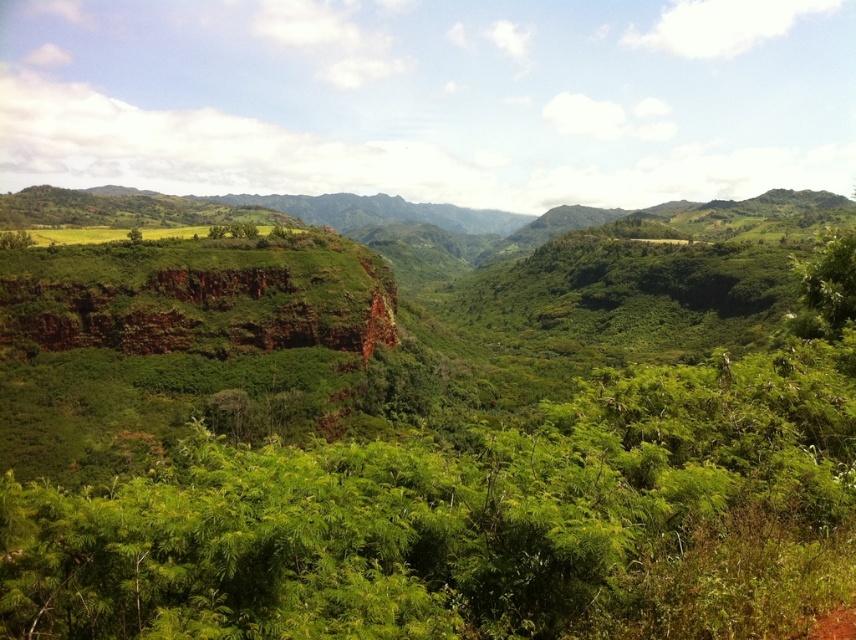
Does green leafy shrubs at center appear on the right side of brown dirt track at lower right?

In fact, green leafy shrubs at center is to the left of brown dirt track at lower right.

Is green leafy shrubs at center positioned in front of brown dirt track at lower right?

Yes, it is.

The width and height of the screenshot is (856, 640). Identify the location of green leafy shrubs at center. (484, 513).